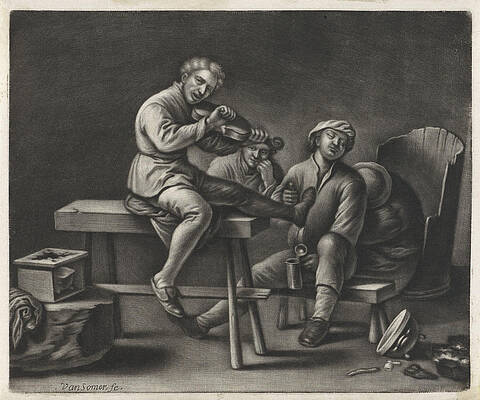
Locate an element on the screen. picture is located at coordinates (305, 202).